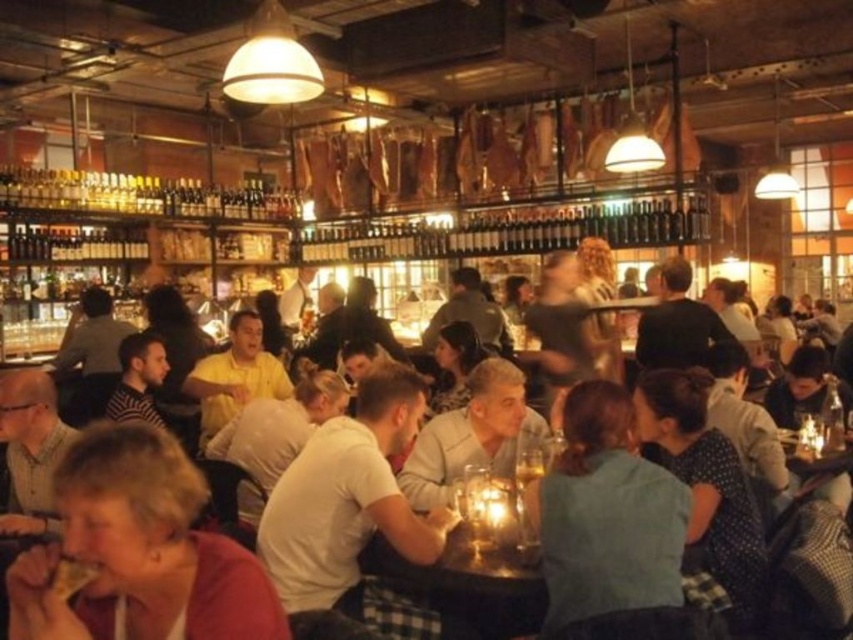
Is matte red shirt at lower left shorter than white cotton shirt at center?

Indeed, matte red shirt at lower left has a lesser height compared to white cotton shirt at center.

Does matte red shirt at lower left have a lesser width compared to white cotton shirt at center?

Indeed, matte red shirt at lower left has a lesser width compared to white cotton shirt at center.

Describe the element at coordinates (138, 550) in the screenshot. The image size is (853, 640). I see `matte red shirt at lower left` at that location.

Identify the location of matte red shirt at lower left. (138, 550).

Can you confirm if white cotton shirt at center is thinner than wooden table at center?

In fact, white cotton shirt at center might be wider than wooden table at center.

Is point (426, 540) farther from viewer compared to point (506, 621)?

No.

You are a GUI agent. You are given a task and a screenshot of the screen. Output one action in this format:
    pyautogui.click(x=<x>, y=<y>)
    Task: Click on the white cotton shirt at center
    Image resolution: width=853 pixels, height=640 pixels.
    Given the screenshot: What is the action you would take?
    pyautogui.click(x=352, y=509)

Does matte red shirt at lower left have a lesser width compared to green fabric shirt at center?

No, matte red shirt at lower left is not thinner than green fabric shirt at center.

Is point (132, 468) positioned before point (614, 580)?

Yes, point (132, 468) is closer to viewer.

Locate an element on the screen. This screenshot has height=640, width=853. matte red shirt at lower left is located at coordinates (138, 550).